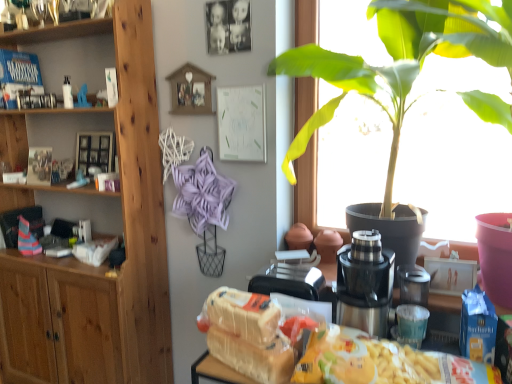
Question: In the image, is translucent plastic bag at lower center positioned in front of or behind satin silver blender at center?

Choices:
 (A) behind
 (B) front

Answer: (B)

Question: Considering the positions of translucent plastic bag at lower center and satin silver blender at center in the image, is translucent plastic bag at lower center bigger or smaller than satin silver blender at center?

Choices:
 (A) small
 (B) big

Answer: (B)

Question: Estimate the real-world distances between objects in this image. Which object is farther from the green leafy plant at upper right?

Choices:
 (A) wooden cabinet at left
 (B) metallic silver coffee machine at center
 (C) translucent plastic bag at lower center
 (D) matte blue toy at left
 (E) satin silver blender at center

Answer: (D)

Question: Which of these objects is positioned farthest from the satin silver blender at center?

Choices:
 (A) matte blue toy at left
 (B) translucent plastic bag at lower center
 (C) green leafy plant at upper right
 (D) metallic silver coffee machine at center
 (E) wooden cabinet at left

Answer: (A)